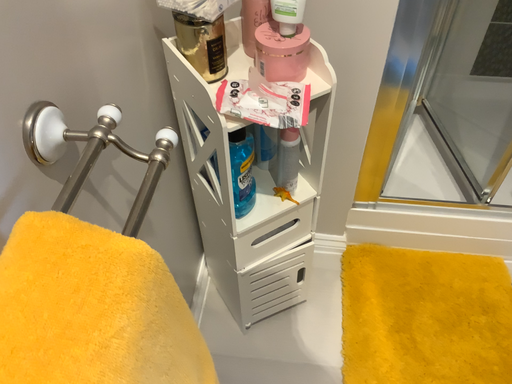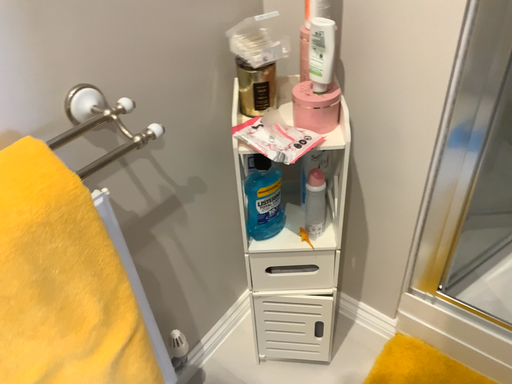
Question: Which way did the camera rotate in the video?

Choices:
 (A) rotated upward
 (B) rotated downward

Answer: (A)